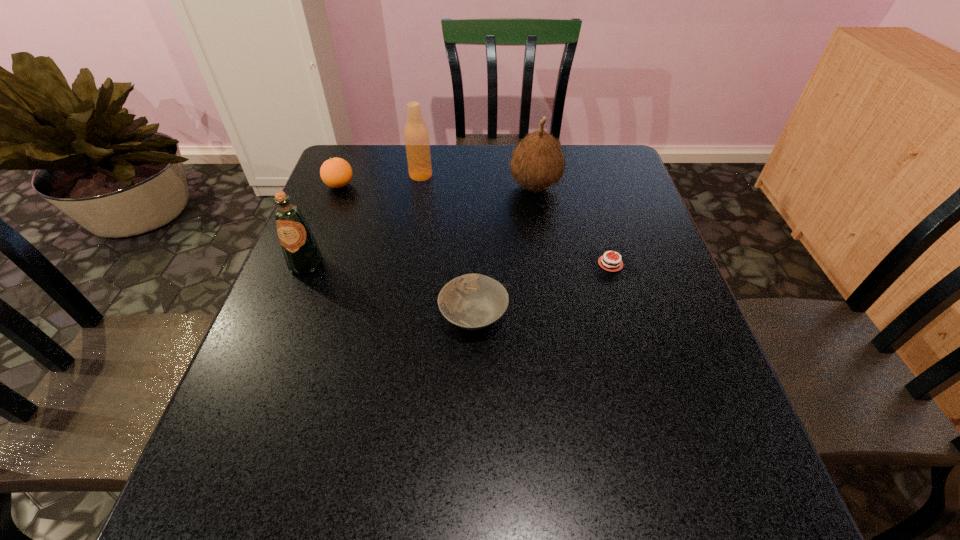
At what (x,y) coordinates should I click in order to perform the action: click on coconut. Please return your answer as a coordinate pair (x, y). Looking at the image, I should click on (538, 162).

Find the location of a particular element. the third object from left to right is located at coordinates (416, 135).

Find the location of a particular element. olive oil is located at coordinates (302, 254).

Image resolution: width=960 pixels, height=540 pixels. In order to click on orange in this screenshot , I will do `click(336, 172)`.

Find the location of `bowl`. bowl is located at coordinates (472, 301).

At what (x,y) coordinates should I click in order to perform the action: click on the fifth tallest object. Please return your answer as a coordinate pair (x, y). The height and width of the screenshot is (540, 960). Looking at the image, I should click on (472, 301).

What are the coordinates of `the rightmost object` in the screenshot? It's located at (609, 264).

At what (x,y) coordinates should I click in order to perform the action: click on the shortest object. Please return your answer as a coordinate pair (x, y). Image resolution: width=960 pixels, height=540 pixels. Looking at the image, I should click on (609, 264).

Where is `vacant space located on the surface of the coconut`? vacant space located on the surface of the coconut is located at coordinates (398, 186).

Locate an element on the screen. This screenshot has height=540, width=960. vacant space situated on the surface of the coconut is located at coordinates (405, 186).